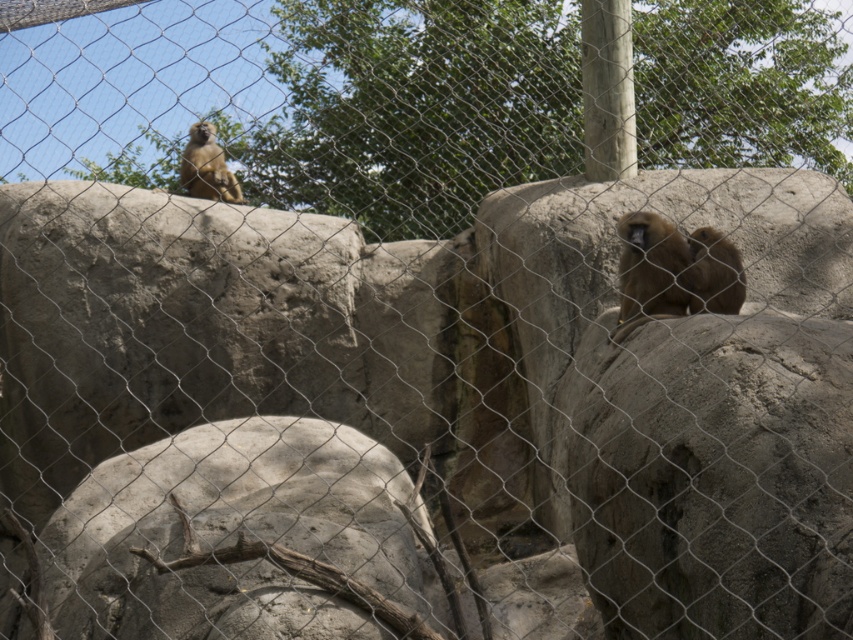
Which of these two, brown furry monkey at right or brown furry monkey at upper left, stands taller?

brown furry monkey at upper left is taller.

Does brown furry monkey at right have a smaller size compared to brown furry monkey at upper left?

Indeed, brown furry monkey at right has a smaller size compared to brown furry monkey at upper left.

Who is more distant from viewer, (717, 312) or (219, 186)?

Positioned behind is point (219, 186).

You are a GUI agent. You are given a task and a screenshot of the screen. Output one action in this format:
    pyautogui.click(x=<x>, y=<y>)
    Task: Click on the brown furry monkey at right
    
    Given the screenshot: What is the action you would take?
    pyautogui.click(x=714, y=273)